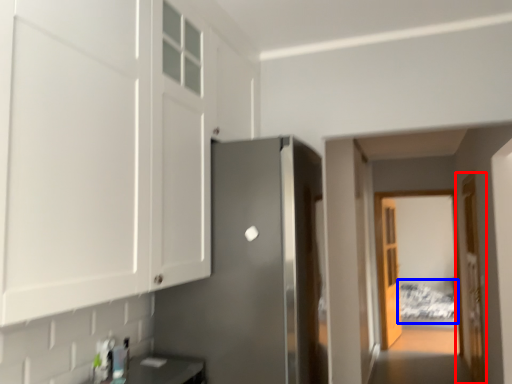
Question: Which point is closer to the camera, door (highlighted by a red box) or bed (highlighted by a blue box)?

Choices:
 (A) door
 (B) bed

Answer: (A)